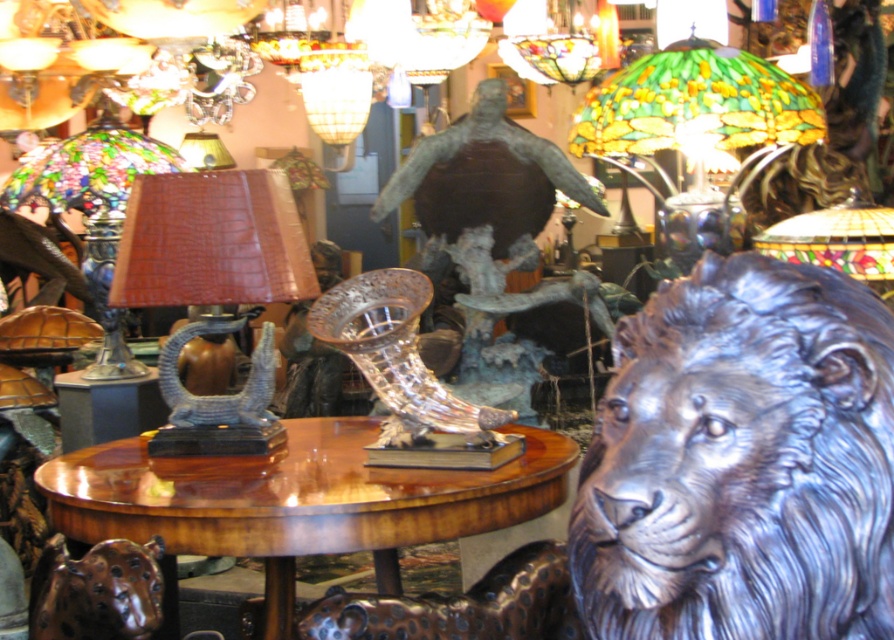
Which is more to the right, shiny silver lion head at center or brown leather lamp at center?

Positioned to the right is shiny silver lion head at center.

The height and width of the screenshot is (640, 894). What do you see at coordinates (741, 461) in the screenshot? I see `shiny silver lion head at center` at bounding box center [741, 461].

Find the location of a particular element. shiny silver lion head at center is located at coordinates (741, 461).

Is shiny wood table at center thinner than brown leather lamp at center?

In fact, shiny wood table at center might be wider than brown leather lamp at center.

Which of these two, shiny wood table at center or brown leather lamp at center, stands shorter?

With less height is shiny wood table at center.

Between point (198, 540) and point (170, 225), which one is positioned behind?

Point (170, 225)

The height and width of the screenshot is (640, 894). I want to click on shiny wood table at center, so click(x=294, y=500).

Does shiny silver lion head at center appear under stained glass lampshade at upper right?

Indeed, shiny silver lion head at center is positioned under stained glass lampshade at upper right.

Is point (802, 614) farther from camera compared to point (685, 125)?

No, it is in front of (685, 125).

The height and width of the screenshot is (640, 894). Identify the location of shiny silver lion head at center. (741, 461).